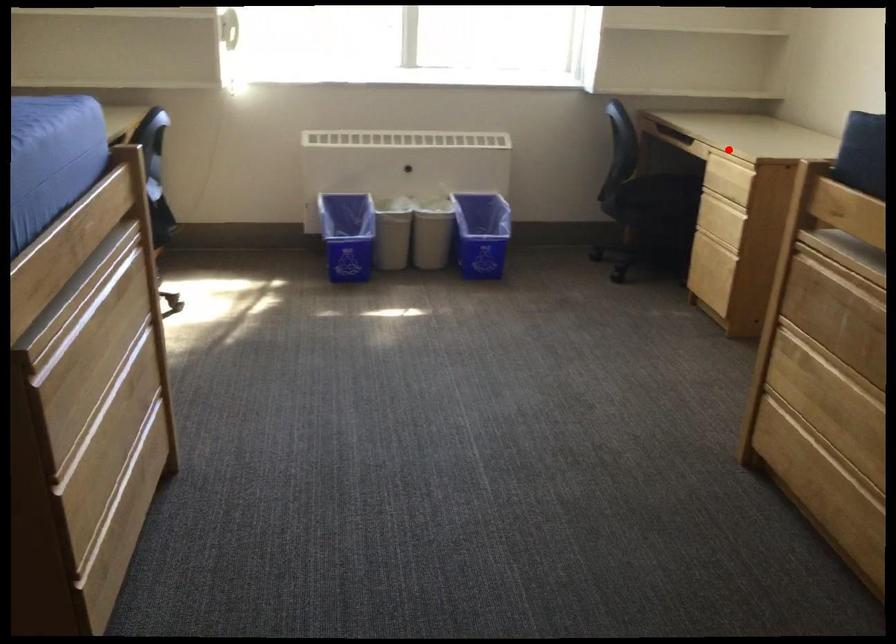
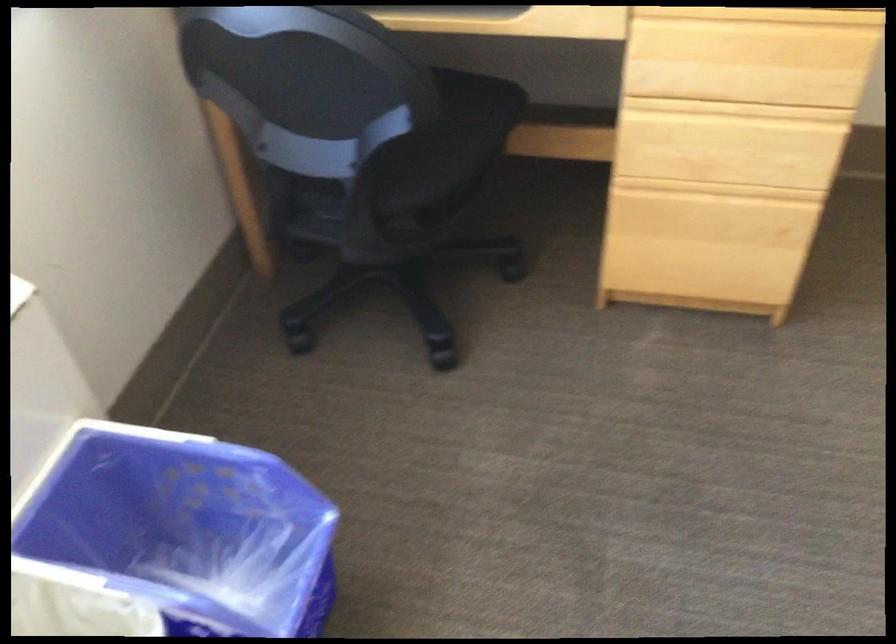
Question: I am providing you with two images of the same scene from different viewpoints. Given a red point in image1, look at the same physical point in image2. Is it:

Choices:
 (A) Closer to the viewpoint
 (B) Farther from the viewpoint

Answer: (A)